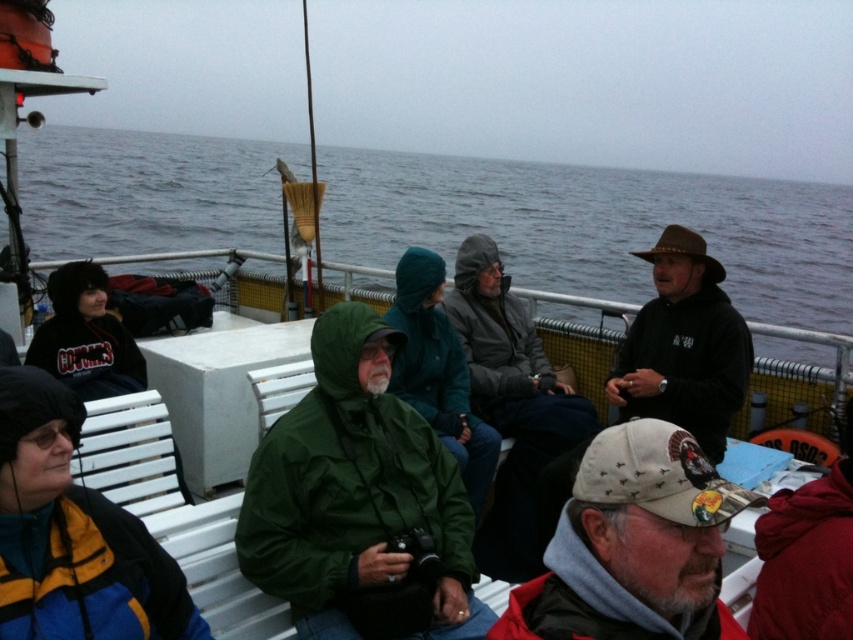
Does brown leather hat at upper right have a smaller size compared to red fleece jacket at lower right?

No.

Who is more forward, [668,248] or [785,572]?

Point [785,572]

Locate an element on the screen. The image size is (853, 640). brown leather hat at upper right is located at coordinates (683, 346).

Who is positioned more to the right, green matte jacket at center or white fabric cap at lower right?

From the viewer's perspective, white fabric cap at lower right appears more on the right side.

Is green matte jacket at center to the left of white fabric cap at lower right from the viewer's perspective?

Yes, green matte jacket at center is to the left of white fabric cap at lower right.

Is point (434, 467) closer to viewer compared to point (585, 476)?

No, it is behind (585, 476).

Find the location of `green matte jacket at center`. green matte jacket at center is located at coordinates (354, 492).

Between gray water at upper center and green matte jacket at center, which one has more height?

Standing taller between the two is gray water at upper center.

Does gray water at upper center appear on the right side of green matte jacket at center?

Yes, gray water at upper center is to the right of green matte jacket at center.

Between point (335, 180) and point (444, 624), which one is positioned in front?

Point (444, 624) is in front.

At what (x,y) coordinates should I click in order to perform the action: click on gray water at upper center. Please return your answer as a coordinate pair (x, y). Looking at the image, I should click on (596, 227).